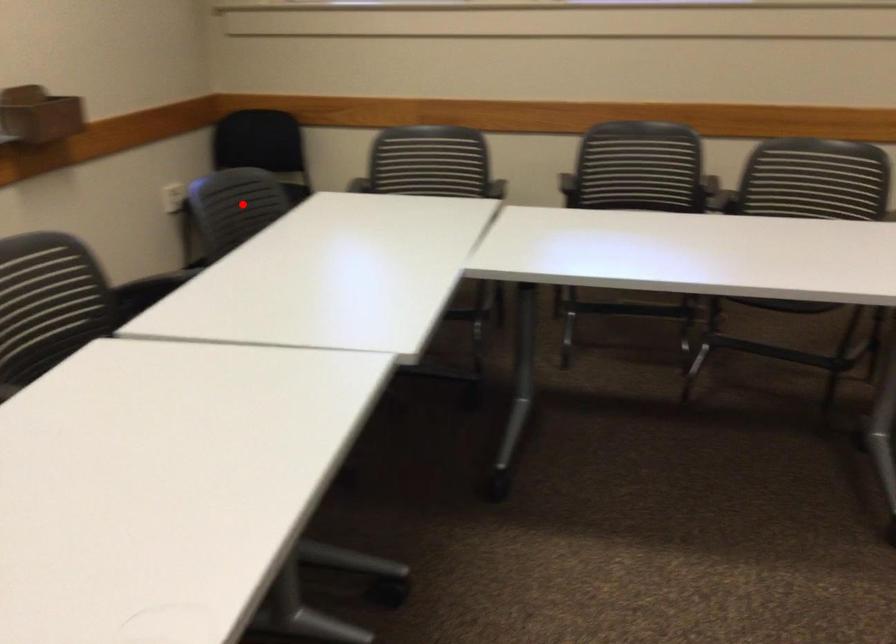
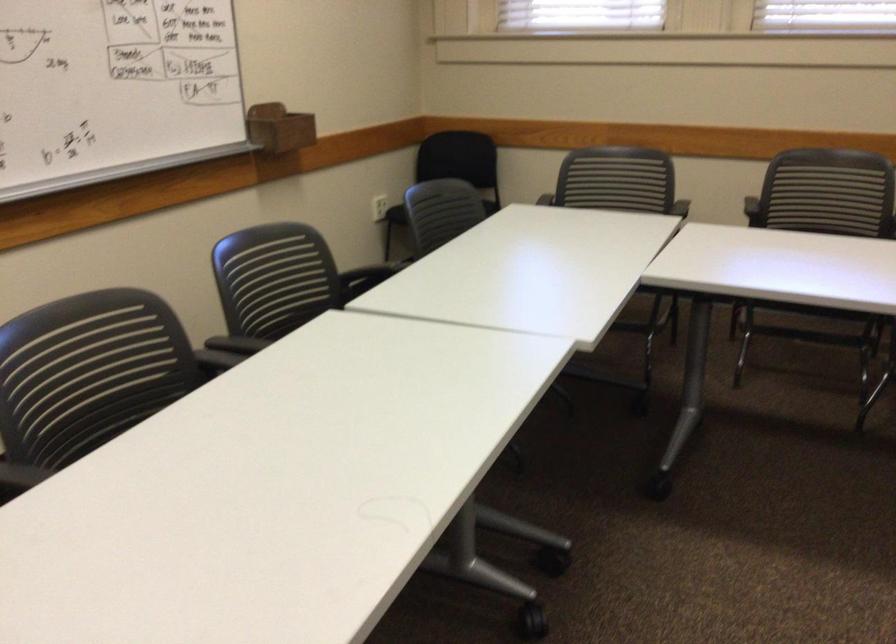
Question: I am providing you with two images of the same scene from different viewpoints. A red point is shown in image1. For the corresponding object point in image2, is it positioned nearer or farther from the camera?

Choices:
 (A) Nearer
 (B) Farther

Answer: (B)